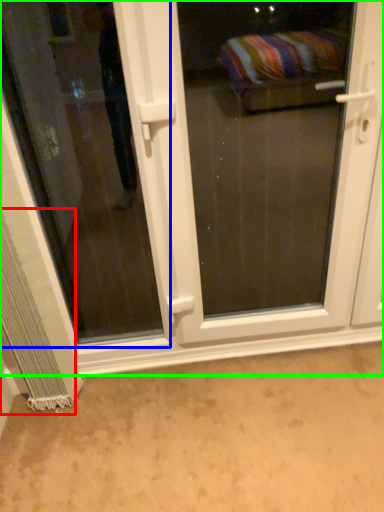
Question: Which is nearer to the curtain (highlighted by a red box)? window (highlighted by a blue box) or door (highlighted by a green box).

Choices:
 (A) window
 (B) door

Answer: (B)